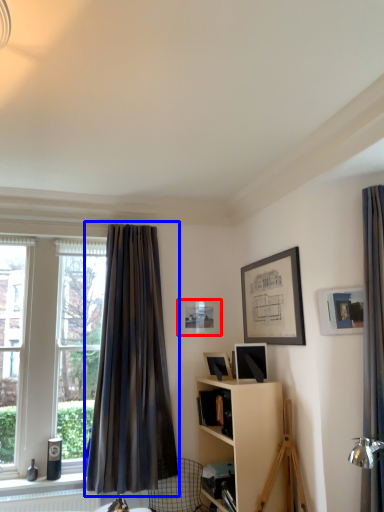
Question: Which point is further to the camera, picture frame (highlighted by a red box) or curtain (highlighted by a blue box)?

Choices:
 (A) picture frame
 (B) curtain

Answer: (A)